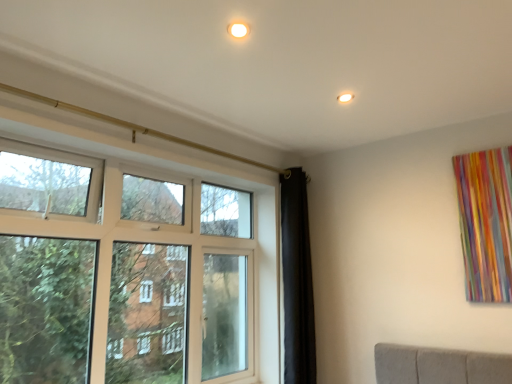
Describe the element at coordinates (132, 273) in the screenshot. The image size is (512, 384). I see `matte white window at left` at that location.

Find the location of a particular element. The height and width of the screenshot is (384, 512). matte white window at left is located at coordinates (132, 273).

You are a GUI agent. You are given a task and a screenshot of the screen. Output one action in this format:
    pyautogui.click(x=<x>, y=<y>)
    Task: Click on the matte white window at left
    
    Given the screenshot: What is the action you would take?
    pyautogui.click(x=132, y=273)